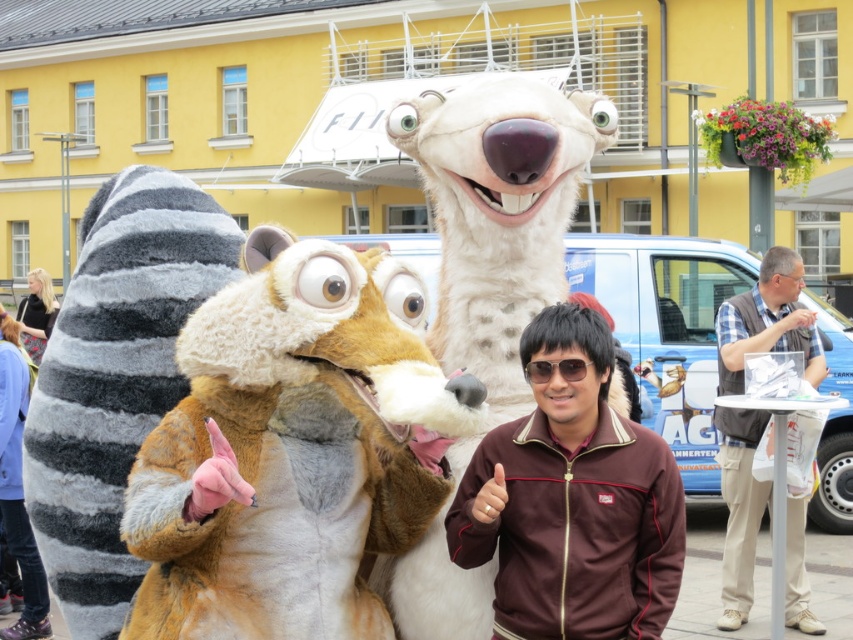
Question: Which point is closer to the camera?

Choices:
 (A) (438, 378)
 (B) (492, 259)

Answer: (A)

Question: Estimate the real-world distances between objects in this image. Which object is farther from the white plush bear at center?

Choices:
 (A) beige fabric vest at right
 (B) sunglasses at center
 (C) fuzzy brown fox at center
 (D) brown fleece jacket at center

Answer: (A)

Question: Which object is farther from the camera taking this photo?

Choices:
 (A) fuzzy brown fox at center
 (B) beige fabric vest at right
 (C) white plush bear at center
 (D) brown fleece jacket at center

Answer: (B)

Question: Is fuzzy brown fox at center wider than beige fabric vest at right?

Choices:
 (A) no
 (B) yes

Answer: (B)

Question: Can you confirm if white plush bear at center is positioned to the right of beige fabric vest at right?

Choices:
 (A) yes
 (B) no

Answer: (B)

Question: Can you confirm if white plush bear at center is wider than brown fleece jacket at center?

Choices:
 (A) no
 (B) yes

Answer: (B)